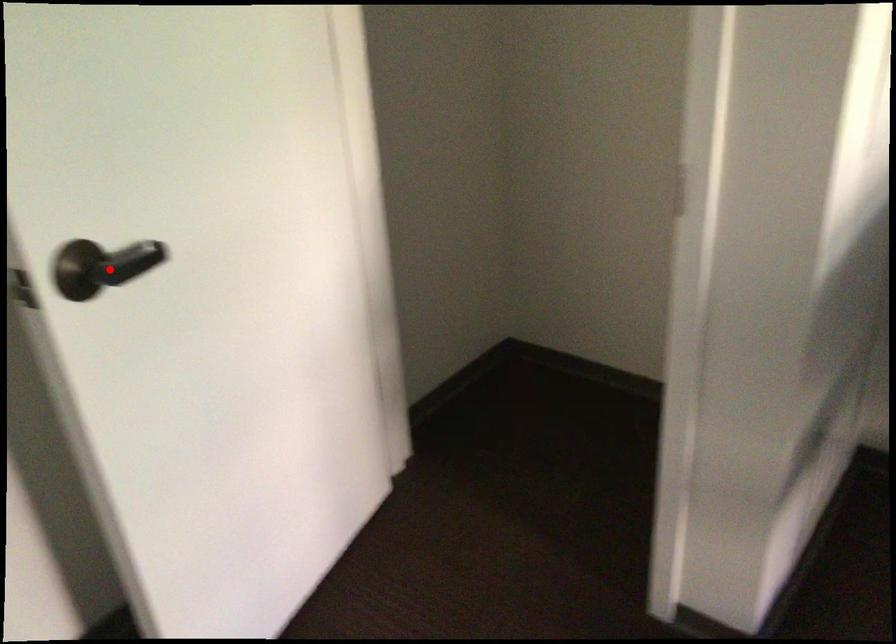
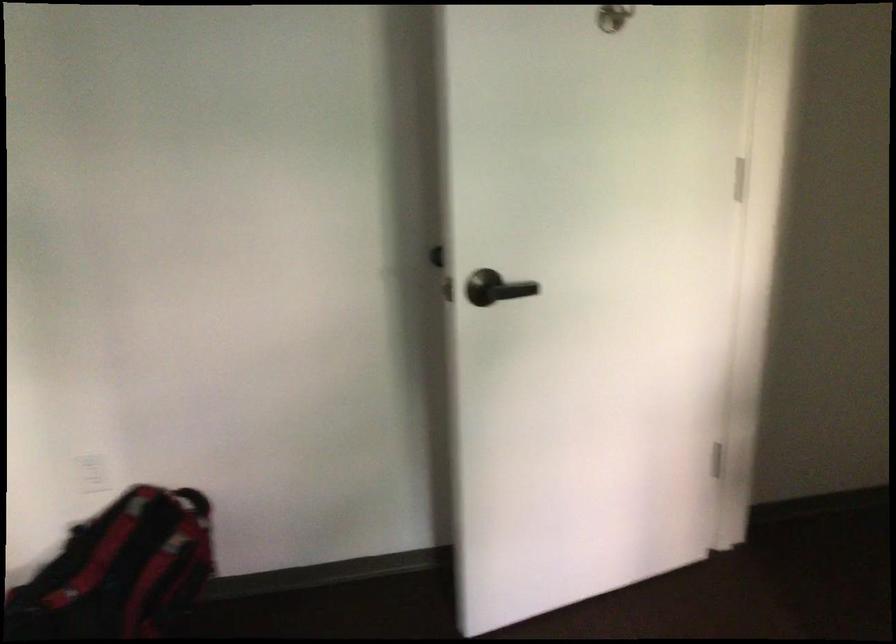
In the second image, find the point that corresponds to the highlighted location in the first image.

(495, 288)